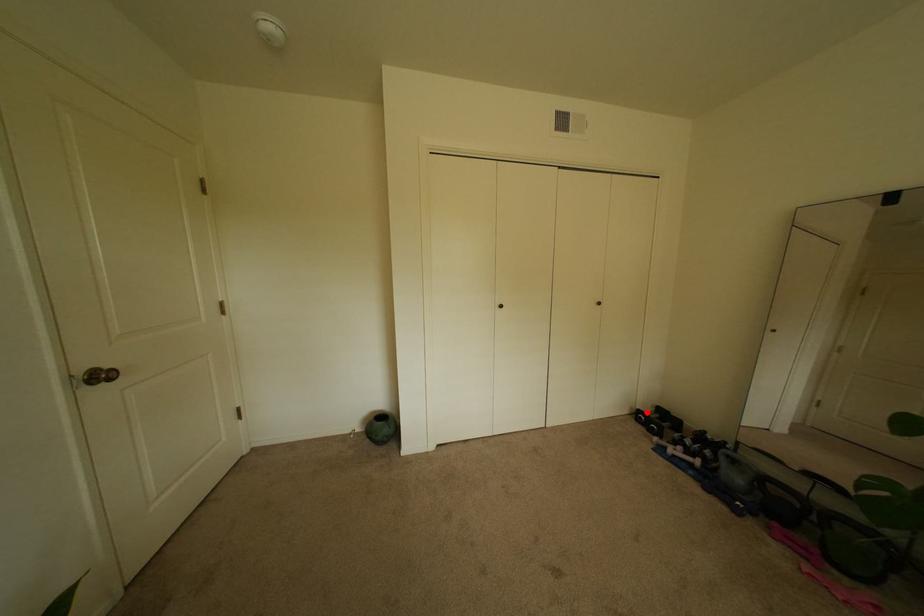
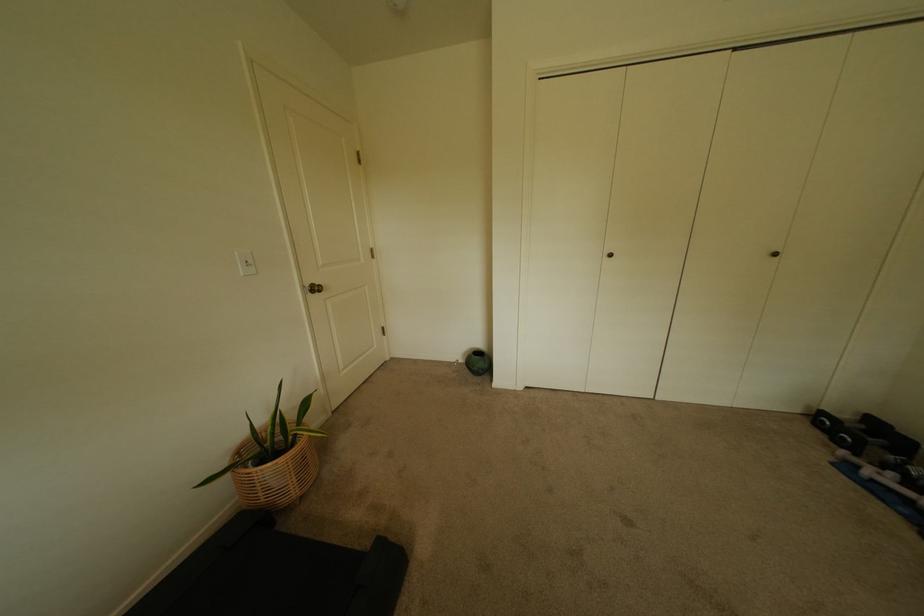
Question: A red point is marked in image1. In image2, is the corresponding 3D point closer to the camera or farther? Reply with the corresponding letter.

Choices:
 (A) The corresponding 3D point is closer.
 (B) The corresponding 3D point is farther.

Answer: (B)